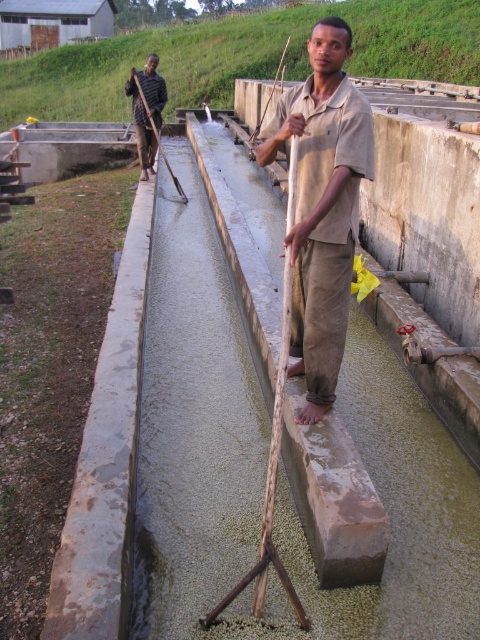
Question: Observing the image, what is the correct spatial positioning of beige cotton shirt at center in reference to dark brown wooden stick at upper left?

Choices:
 (A) above
 (B) below

Answer: (B)

Question: Which of the following is the closest to the observer?

Choices:
 (A) beige cotton shirt at center
 (B) dark brown wooden stick at upper left

Answer: (A)

Question: Which object appears closest to the camera in this image?

Choices:
 (A) dark brown wooden stick at upper left
 (B) beige cotton shirt at center

Answer: (B)

Question: Where is beige cotton shirt at center located in relation to dark brown wooden stick at upper left in the image?

Choices:
 (A) right
 (B) left

Answer: (A)

Question: Does beige cotton shirt at center lie in front of dark brown wooden stick at upper left?

Choices:
 (A) no
 (B) yes

Answer: (B)